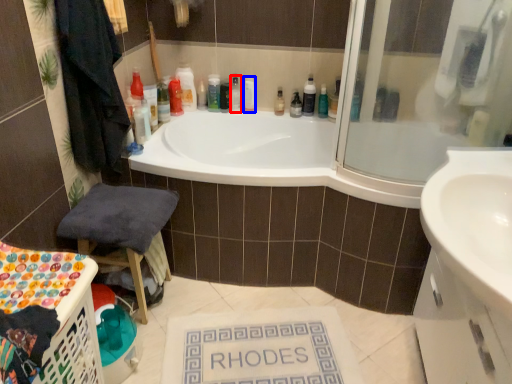
Question: Which point is closer to the camera, toiletry (highlighted by a red box) or toiletry (highlighted by a blue box)?

Choices:
 (A) toiletry
 (B) toiletry

Answer: (A)